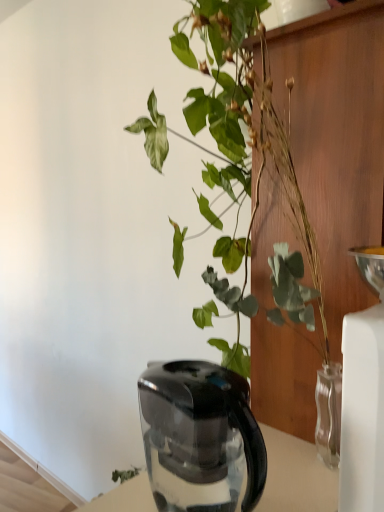
Locate an element on the screen. The width and height of the screenshot is (384, 512). black plastic kettle at lower center is located at coordinates click(200, 437).

The width and height of the screenshot is (384, 512). What do you see at coordinates (200, 437) in the screenshot?
I see `black plastic kettle at lower center` at bounding box center [200, 437].

Measure the distance between black plastic kettle at lower center and camera.

A distance of 24.50 inches exists between black plastic kettle at lower center and camera.

This screenshot has height=512, width=384. Describe the element at coordinates (256, 192) in the screenshot. I see `green glossy plant at upper center` at that location.

Where is `green glossy plant at upper center`? green glossy plant at upper center is located at coordinates (256, 192).

Locate an element on the screen. This screenshot has width=384, height=512. black plastic kettle at lower center is located at coordinates (200, 437).

Which object is positioned more to the right, green glossy plant at upper center or black plastic kettle at lower center?

From the viewer's perspective, green glossy plant at upper center appears more on the right side.

Is the depth of green glossy plant at upper center less than that of black plastic kettle at lower center?

That is True.

Is point (206, 32) positioned before point (245, 452)?

No, it is behind (245, 452).

From the image's perspective, relative to black plastic kettle at lower center, is green glossy plant at upper center above or below?

green glossy plant at upper center is above black plastic kettle at lower center.

From a real-world perspective, who is located higher, green glossy plant at upper center or black plastic kettle at lower center?

green glossy plant at upper center is physically above.

Is green glossy plant at upper center thinner than black plastic kettle at lower center?

In fact, green glossy plant at upper center might be wider than black plastic kettle at lower center.

Considering the relative sizes of green glossy plant at upper center and black plastic kettle at lower center in the image provided, is green glossy plant at upper center taller than black plastic kettle at lower center?

Yes.

Does green glossy plant at upper center have a smaller size compared to black plastic kettle at lower center?

Incorrect, green glossy plant at upper center is not smaller in size than black plastic kettle at lower center.

Is green glossy plant at upper center completely or partially outside of black plastic kettle at lower center?

Yes.

Are green glossy plant at upper center and black plastic kettle at lower center beside each other?

There is a gap between green glossy plant at upper center and black plastic kettle at lower center.

Is green glossy plant at upper center facing towards black plastic kettle at lower center?

Yes.

How many degrees apart are the facing directions of green glossy plant at upper center and black plastic kettle at lower center?

There is a 0.812-degree angle between the facing directions of green glossy plant at upper center and black plastic kettle at lower center.

Where is `houseplant above the black plastic kettle at lower center (from the image's perspective)`? The height and width of the screenshot is (512, 384). houseplant above the black plastic kettle at lower center (from the image's perspective) is located at coordinates (256, 192).

Considering the relative positions of black plastic kettle at lower center and green glossy plant at upper center in the image provided, is black plastic kettle at lower center to the left of green glossy plant at upper center from the viewer's perspective?

Indeed, black plastic kettle at lower center is positioned on the left side of green glossy plant at upper center.

Is the depth of black plastic kettle at lower center less than that of green glossy plant at upper center?

No, black plastic kettle at lower center is further to the viewer.

Is point (233, 466) closer or farther from the camera than point (242, 15)?

Clearly, point (233, 466) is closer to the camera than point (242, 15).

From the image's perspective, between black plastic kettle at lower center and green glossy plant at upper center, which one is located above?

green glossy plant at upper center is shown above in the image.

From a real-world perspective, is black plastic kettle at lower center physically above green glossy plant at upper center?

Incorrect, from a real-world perspective, black plastic kettle at lower center is lower than green glossy plant at upper center.

Can you confirm if black plastic kettle at lower center is thinner than green glossy plant at upper center?

Yes, black plastic kettle at lower center is thinner than green glossy plant at upper center.

Based on the photo, in terms of height, does black plastic kettle at lower center look taller or shorter compared to green glossy plant at upper center?

Considering their sizes, black plastic kettle at lower center has less height than green glossy plant at upper center.

Looking at this image, who is bigger, black plastic kettle at lower center or green glossy plant at upper center?

green glossy plant at upper center is bigger.

Is black plastic kettle at lower center inside the boundaries of green glossy plant at upper center, or outside?

black plastic kettle at lower center fits inside green glossy plant at upper center.

Is black plastic kettle at lower center not close to green glossy plant at upper center?

black plastic kettle at lower center is near green glossy plant at upper center, not far away.

Is black plastic kettle at lower center looking in the opposite direction of green glossy plant at upper center?

Yes, black plastic kettle at lower center is positioned with its back facing green glossy plant at upper center.

What's the angular difference between black plastic kettle at lower center and green glossy plant at upper center's facing directions?

They differ by 0.812 degrees in their facing directions.

How distant is black plastic kettle at lower center from green glossy plant at upper center?

black plastic kettle at lower center and green glossy plant at upper center are 14.31 inches apart.

In the image, there is a black plastic kettle at lower center. Where is `houseplant above it (from the image's perspective)`? Image resolution: width=384 pixels, height=512 pixels. houseplant above it (from the image's perspective) is located at coordinates (256, 192).

This screenshot has height=512, width=384. I want to click on houseplant above the black plastic kettle at lower center (from a real-world perspective), so click(x=256, y=192).

The image size is (384, 512). Identify the location of kettle behind the green glossy plant at upper center. (200, 437).